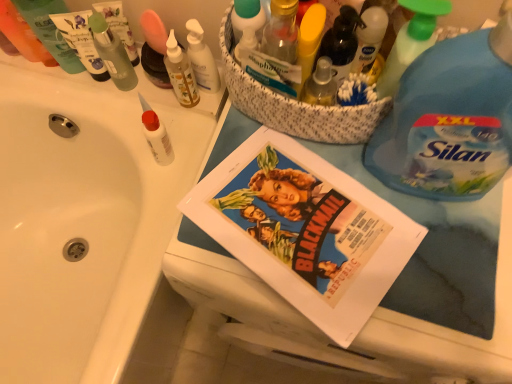
Question: In terms of height, does translucent plastic bottle at upper center look taller or shorter compared to green plastic spray bottle at upper right, placed as the 1th cleaning product when sorted from left to right?

Choices:
 (A) short
 (B) tall

Answer: (A)

Question: Is translucent plastic bottle at upper center spatially inside green plastic spray bottle at upper right, placed as the 1th cleaning product when sorted from left to right, or outside of it?

Choices:
 (A) outside
 (B) inside

Answer: (A)

Question: Which object is the farthest from the white matte glue at upper left, placed as the 4th toiletry when sorted from right to left?

Choices:
 (A) matte paper comic book at center
 (B) translucent plastic pump bottle at upper center, positioned as the 3th toiletry in right-to-left order
 (C) translucent plastic bottle at upper left, which ranks as the 1th toiletry in left-to-right order
 (D) blue plastic bottle at right, the first cleaning product when ordered from right to left
 (E) green plastic spray bottle at upper right, marked as the 2th cleaning product in a right-to-left arrangement

Answer: (D)

Question: Considering the real-world distances, which object is closest to the green translucent bottle at upper left, which is the 4th toiletry in left-to-right order?

Choices:
 (A) translucent plastic bottle at upper left, arranged as the 8th toiletry when viewed from the right
 (B) matte paper comic book at center
 (C) blue plastic bottle at right, the first cleaning product when ordered from right to left
 (D) green plastic tube at upper left, placed as the 7th toiletry when sorted from right to left
 (E) translucent plastic bottle at upper center

Answer: (D)